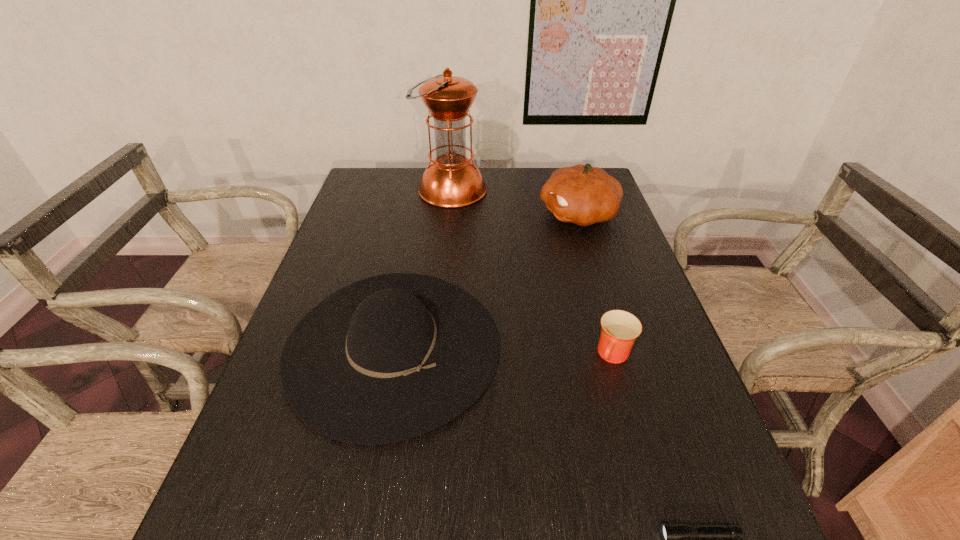
At what (x,y) coordinates should I click in order to perform the action: click on oil lamp present at the far edge. Please return your answer as a coordinate pair (x, y). Image resolution: width=960 pixels, height=540 pixels. Looking at the image, I should click on (451, 180).

The image size is (960, 540). I want to click on pumpkin that is at the far edge, so click(x=581, y=194).

The width and height of the screenshot is (960, 540). I want to click on object at the left edge, so click(388, 358).

In order to click on pumpkin located in the right edge section of the desktop in this screenshot , I will do `click(581, 194)`.

Locate an element on the screen. Image resolution: width=960 pixels, height=540 pixels. cup present at the right edge is located at coordinates (620, 329).

The image size is (960, 540). I want to click on object situated at the far right corner, so click(581, 194).

Find the location of a particular element. Image resolution: width=960 pixels, height=540 pixels. vacant position at the far edge of the desktop is located at coordinates (486, 200).

Where is `vacant area at the left edge of the desktop`? vacant area at the left edge of the desktop is located at coordinates (386, 217).

Locate an element on the screen. The height and width of the screenshot is (540, 960). vacant space at the right edge of the desktop is located at coordinates (587, 232).

The height and width of the screenshot is (540, 960). What are the coordinates of `vacant region at the far left corner` in the screenshot? It's located at (390, 192).